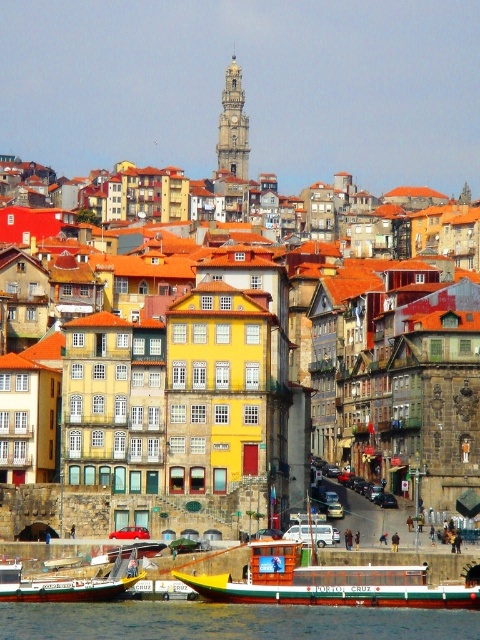
You are a tourist standing at the riverside and want to take a photo of the wooden boat at lower left. To avoid including the buildings in the background, where should you position yourself relative to the transparent water at lower center?

You should position yourself to the left of the transparent water at lower center because the wooden boat at lower left is located to the left of the transparent water at lower center, and moving left would place the buildings out of the frame.

You are standing at the point with coordinates point (78, 593) and want to walk to the point with coordinates point (425, 282). According to the scene, will you be able to see the point 0.447, 0.887 from your current position?

Point (425, 282) is behind point (78, 593), so you cannot see it from your current position.

You are standing at the point marked as point (215, 483) in the image, which is part of a historic riverside town. You want to take a photo of the entire town without any obstructions. Considering your current position, can you see the entire town clearly from here?

A: The point marked as point (215, 483) is 110.04 meters away from the viewer. Since the town is spread out in the midground with buildings of varying heights and styles, it is possible that some taller buildings might obstruct the view of the entire town from this distance. To capture the entire town without obstructions, you might need to adjust your position to a higher vantage point or move further back to ensure all structures are visible.